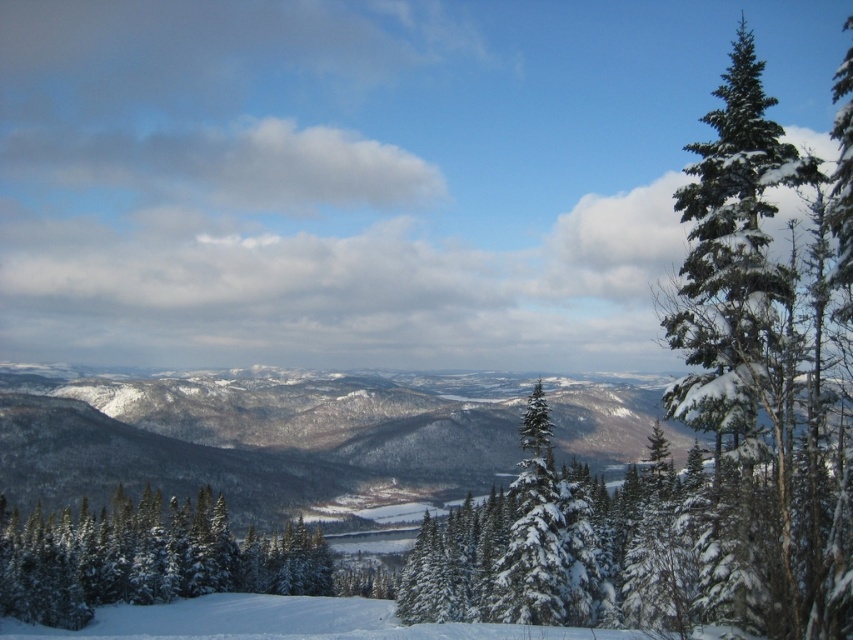
Question: Is white snow-covered trees at lower left wider than white snow ski slope at lower center?

Choices:
 (A) yes
 (B) no

Answer: (B)

Question: Which point is farther from the camera taking this photo?

Choices:
 (A) [227, 636]
 (B) [38, 548]

Answer: (B)

Question: Which object appears farthest from the camera in this image?

Choices:
 (A) white snow ski slope at lower center
 (B) green snow-covered evergreen at right

Answer: (A)

Question: Does green snow-covered evergreen at right have a greater width compared to white snow-covered trees at lower left?

Choices:
 (A) yes
 (B) no

Answer: (A)

Question: Considering the relative positions of green snow-covered evergreen at right and white snow ski slope at lower center in the image provided, where is green snow-covered evergreen at right located with respect to white snow ski slope at lower center?

Choices:
 (A) right
 (B) left

Answer: (A)

Question: Which point appears farthest from the camera in this image?

Choices:
 (A) (808, 163)
 (B) (352, 600)
 (C) (122, 573)

Answer: (B)